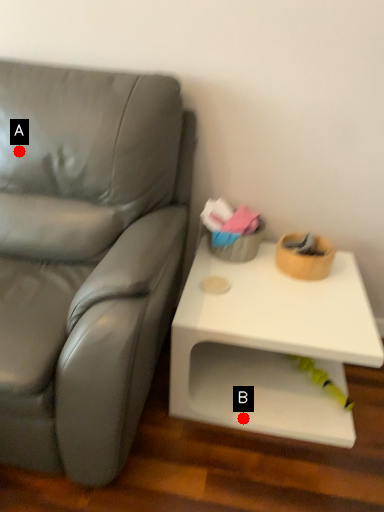
Question: Two points are circled on the image, labeled by A and B beside each circle. Which of the following is the farthest from the observer?

Choices:
 (A) A is further
 (B) B is further

Answer: (A)